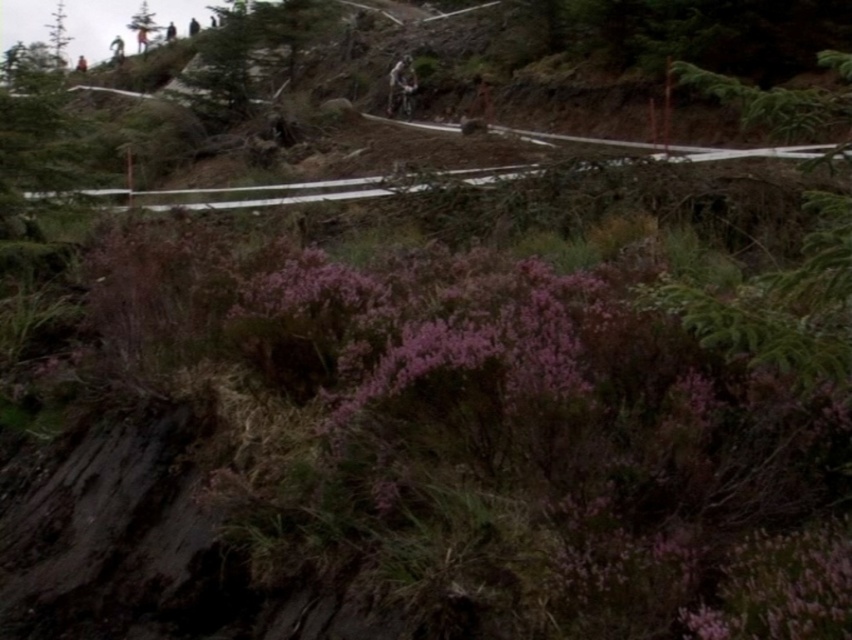
You are standing at the point labeled point (x=769, y=310) and want to walk towards the point labeled point (x=50, y=49). Which direction should you face to move towards it?

Since point (x=769, y=310) is closer to the viewer than point (x=50, y=49), you should face towards the lower left direction to move towards point (x=50, y=49).

You are standing at the center of the dirt path and notice two green leafy trees in the background. Which tree is closer to you, the green leafy tree at upper right or the green leafy tree at upper left?

The green leafy tree at upper right is closer to you because it is in front of the green leafy tree at upper left.

You are standing on the dirt path in the middle ground and want to walk towards the green leafy tree at upper right. Which direction should you turn to avoid the green matte tree at upper left?

You should turn to the right to head towards the green leafy tree at upper right, as it is positioned to the right of the green matte tree at upper left.